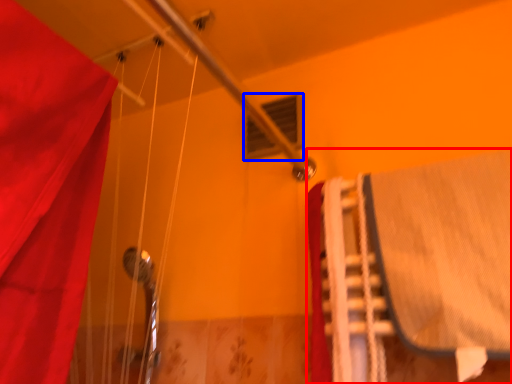
Question: Which object is closer to the camera taking this photo, bed (highlighted by a red box) or window (highlighted by a blue box)?

Choices:
 (A) bed
 (B) window

Answer: (A)